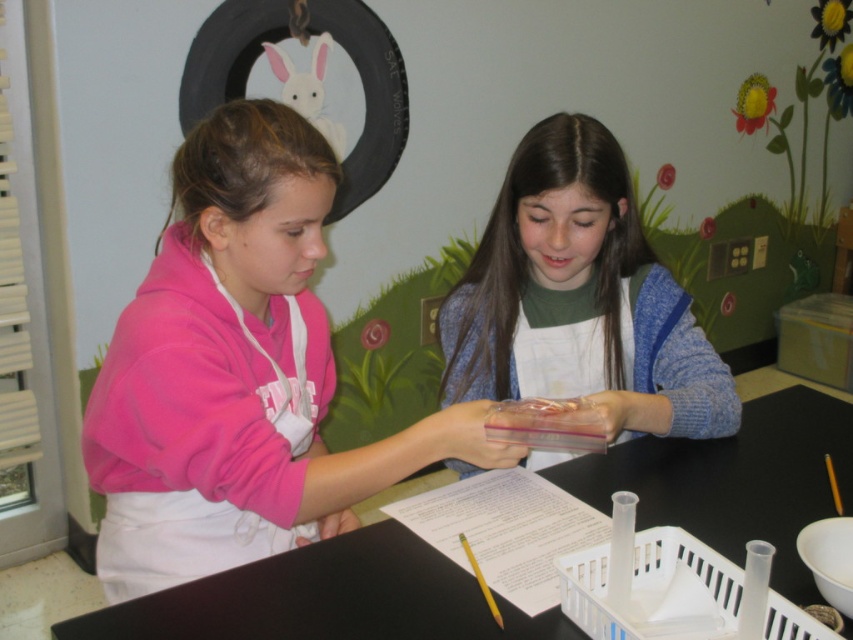
Question: Which point is closer to the camera?

Choices:
 (A) translucent plastic container at center
 (B) pink fleece jacket at left

Answer: (B)

Question: Which object is positioned farthest from the pink fleece jacket at left?

Choices:
 (A) translucent plastic container at center
 (B) black plastic table at center

Answer: (B)

Question: Can you confirm if pink fleece jacket at left is smaller than translucent plastic container at center?

Choices:
 (A) no
 (B) yes

Answer: (A)

Question: Does pink fleece jacket at left lie behind translucent plastic container at center?

Choices:
 (A) yes
 (B) no

Answer: (B)

Question: Among these objects, which one is farthest from the camera?

Choices:
 (A) black plastic table at center
 (B) pink fleece jacket at left
 (C) translucent plastic container at center

Answer: (C)

Question: Is pink fleece jacket at left thinner than black plastic table at center?

Choices:
 (A) no
 (B) yes

Answer: (B)